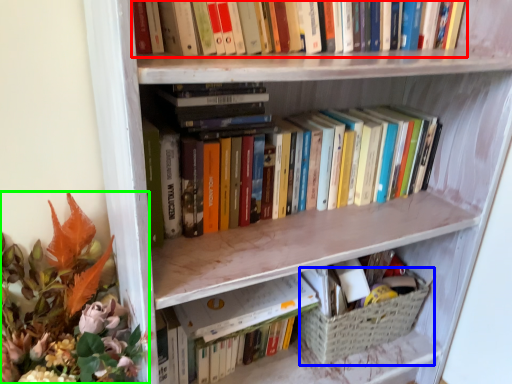
Question: Which object is positioned farthest from book (highlighted by a red box)? Select from basket (highlighted by a blue box) and floral arrangement (highlighted by a green box).

Choices:
 (A) basket
 (B) floral arrangement

Answer: (A)